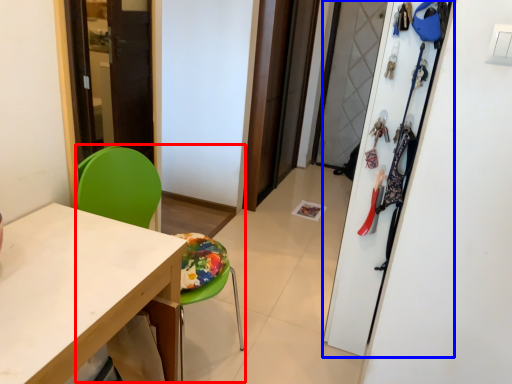
Question: Among these objects, which one is farthest to the camera, armchair (highlighted by a red box) or closet (highlighted by a blue box)?

Choices:
 (A) armchair
 (B) closet

Answer: (B)